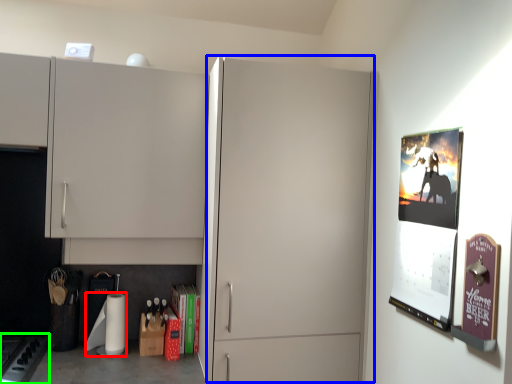
Question: Based on their relative distances, which object is nearer to toilet paper (highlighted by a red box)? Choose from glass door (highlighted by a blue box) and gas stove (highlighted by a green box).

Choices:
 (A) glass door
 (B) gas stove

Answer: (B)